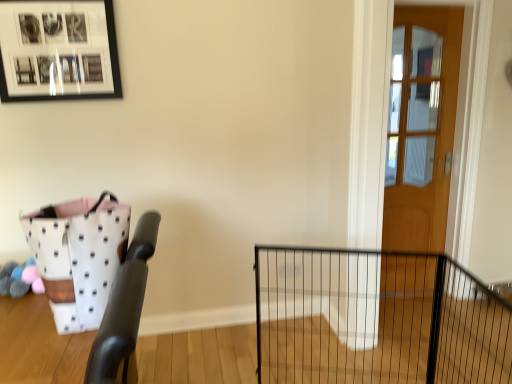
Question: From the image's perspective, would you say white dotted fabric basket at left is shown under wooden door at right?

Choices:
 (A) no
 (B) yes

Answer: (B)

Question: Could you tell me if white dotted fabric basket at left is facing wooden door at right?

Choices:
 (A) yes
 (B) no

Answer: (B)

Question: Is white dotted fabric basket at left far away from wooden door at right?

Choices:
 (A) yes
 (B) no

Answer: (A)

Question: Is white dotted fabric basket at left taller than wooden door at right?

Choices:
 (A) yes
 (B) no

Answer: (B)

Question: From the image's perspective, is white dotted fabric basket at left above wooden door at right?

Choices:
 (A) yes
 (B) no

Answer: (B)

Question: Does point (503, 321) appear closer or farther from the camera than point (430, 51)?

Choices:
 (A) farther
 (B) closer

Answer: (A)

Question: Do you think black wire fence at center is within wooden door at right, or outside of it?

Choices:
 (A) inside
 (B) outside

Answer: (B)

Question: From a real-world perspective, is black wire fence at center positioned above or below wooden door at right?

Choices:
 (A) below
 (B) above

Answer: (A)

Question: Looking at their shapes, would you say black wire fence at center is wider or thinner than wooden door at right?

Choices:
 (A) thin
 (B) wide

Answer: (B)

Question: From the image's perspective, is black matte picture frame at upper left positioned above or below black wire fence at center?

Choices:
 (A) below
 (B) above

Answer: (B)

Question: Considering the positions of black matte picture frame at upper left and black wire fence at center in the image, is black matte picture frame at upper left taller or shorter than black wire fence at center?

Choices:
 (A) short
 (B) tall

Answer: (A)

Question: In terms of size, does black matte picture frame at upper left appear bigger or smaller than black wire fence at center?

Choices:
 (A) big
 (B) small

Answer: (B)

Question: Considering the positions of point (114, 59) and point (459, 375), is point (114, 59) closer or farther from the camera than point (459, 375)?

Choices:
 (A) farther
 (B) closer

Answer: (B)

Question: Considering the positions of black wire fence at center and black matte picture frame at upper left in the image, is black wire fence at center bigger or smaller than black matte picture frame at upper left?

Choices:
 (A) small
 (B) big

Answer: (B)

Question: In terms of width, does black wire fence at center look wider or thinner when compared to black matte picture frame at upper left?

Choices:
 (A) wide
 (B) thin

Answer: (A)